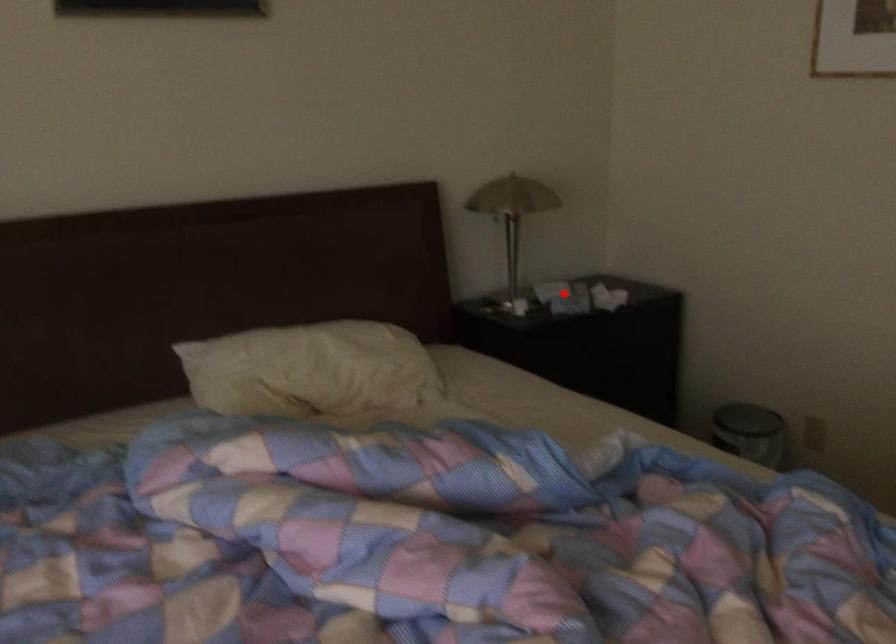
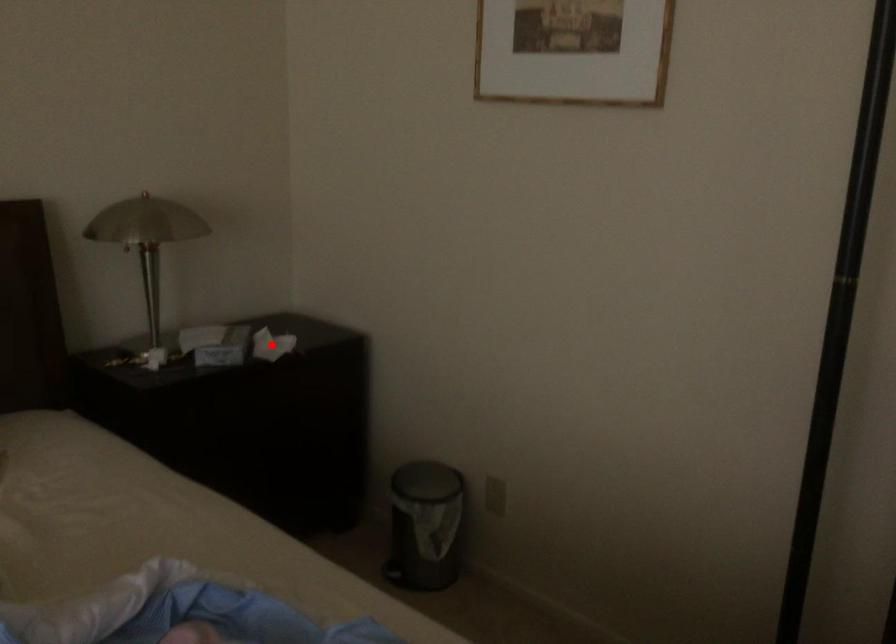
I am providing you with two images of the same scene from different viewpoints. A red point is marked on the first image and another point is marked on the second image. Is the marked point in image1 the same physical position as the marked point in image2?

No